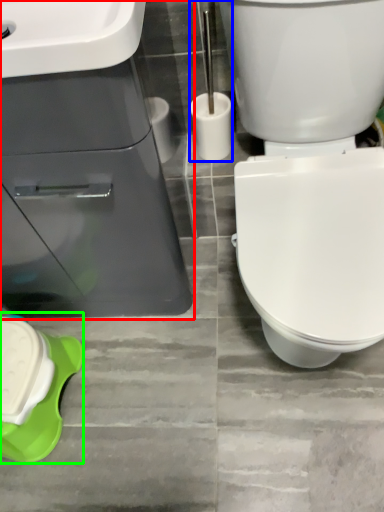
Question: Which object is positioned closest to sink (highlighted by a red box)? Select from brush (highlighted by a blue box) and porcelain (highlighted by a green box).

Choices:
 (A) brush
 (B) porcelain

Answer: (B)